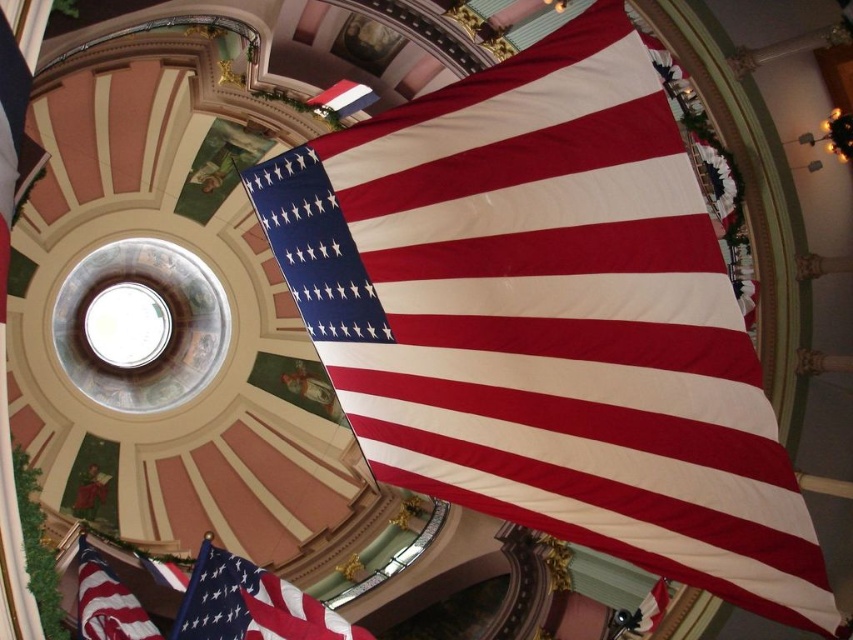
Between point (490, 470) and point (369, 93), which one is positioned in front?

Positioned in front is point (490, 470).

Is the position of matte fabric flag at center less distant than that of white glossy flag at center?

Yes, matte fabric flag at center is in front of white glossy flag at center.

Between point (587, 397) and point (309, 99), which one is positioned behind?

The point (309, 99) is behind.

Find the location of a particular element. The width and height of the screenshot is (853, 640). matte fabric flag at center is located at coordinates (548, 317).

Who is more forward, (213, 614) or (338, 115)?

Point (213, 614) is in front.

Can you confirm if matte cotton flag at center is taller than white glossy flag at center?

Yes.

Which is behind, point (326, 634) or point (360, 108)?

Positioned behind is point (360, 108).

At what (x,y) coordinates should I click in order to perform the action: click on matte cotton flag at center. Please return your answer as a coordinate pair (x, y). The height and width of the screenshot is (640, 853). Looking at the image, I should click on (251, 604).

What do you see at coordinates (251, 604) in the screenshot? The height and width of the screenshot is (640, 853). I see `matte cotton flag at center` at bounding box center [251, 604].

Is matte cotton flag at center above matte red flag at lower left?

Yes, matte cotton flag at center is above matte red flag at lower left.

Find the location of a particular element. matte cotton flag at center is located at coordinates (251, 604).